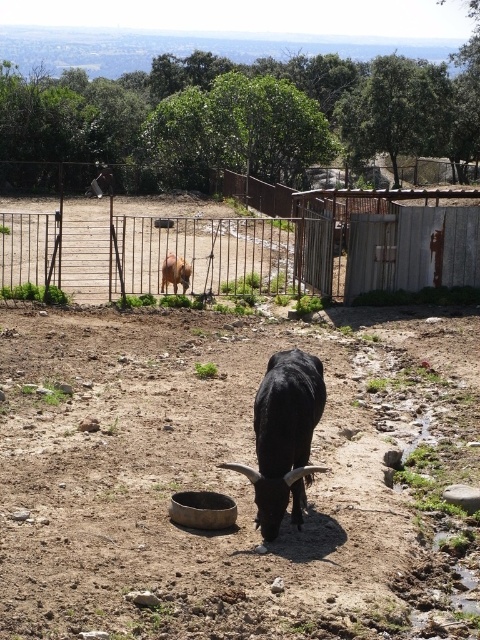
Between point (168, 444) and point (310, 232), which one is positioned in front?

Positioned in front is point (168, 444).

Find the location of a particular element. The width and height of the screenshot is (480, 640). brown soil at center is located at coordinates (233, 477).

Does black matte/yak at center have a lesser height compared to light brown fur at center?

In fact, black matte/yak at center may be taller than light brown fur at center.

Is point (266, 417) more distant than point (183, 275)?

No, it is in front of (183, 275).

Locate an element on the screen. black matte/yak at center is located at coordinates (284, 436).

Which is more to the right, rusty metal fence at upper center or light brown fur at center?

light brown fur at center

Locate an element on the screen. The image size is (480, 640). rusty metal fence at upper center is located at coordinates (256, 244).